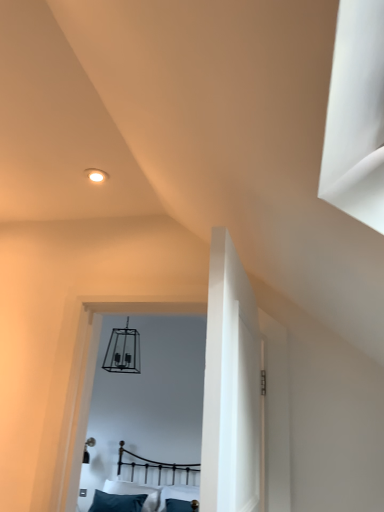
Based on the photo, measure the distance between teal fabric pillow at lower center and camera.

They are 14.17 feet apart.

Image resolution: width=384 pixels, height=512 pixels. Describe the element at coordinates (117, 502) in the screenshot. I see `teal fabric pillow at lower center` at that location.

You are a GUI agent. You are given a task and a screenshot of the screen. Output one action in this format:
    pyautogui.click(x=<x>, y=<y>)
    Task: Click on the teal fabric pillow at lower center
    This screenshot has height=512, width=384.
    Given the screenshot: What is the action you would take?
    pyautogui.click(x=117, y=502)

Find the location of a particular element. The height and width of the screenshot is (512, 384). metallic black bed at center is located at coordinates (152, 477).

What is the approximate height of metallic black bed at center?

The height of metallic black bed at center is 31.54 inches.

Describe the element at coordinates (152, 477) in the screenshot. I see `metallic black bed at center` at that location.

The image size is (384, 512). Identify the location of teal fabric pillow at lower center. (117, 502).

Considering the relative positions of metallic black bed at center and teal fabric pillow at lower center in the image provided, is metallic black bed at center to the left or to the right of teal fabric pillow at lower center?

metallic black bed at center is positioned on teal fabric pillow at lower center's right side.

From the picture: Which object is closer to the camera taking this photo, metallic black bed at center or teal fabric pillow at lower center?

metallic black bed at center is closer to the camera.

Which is in front, point (167, 481) or point (99, 506)?

The point (99, 506) is closer.

From the image's perspective, is metallic black bed at center over teal fabric pillow at lower center?

Yes, from the image's perspective, metallic black bed at center is over teal fabric pillow at lower center.

From a real-world perspective, between metallic black bed at center and teal fabric pillow at lower center, who is vertically lower?

teal fabric pillow at lower center.

Considering the relative sizes of metallic black bed at center and teal fabric pillow at lower center in the image provided, is metallic black bed at center wider than teal fabric pillow at lower center?

Yes.

Who is shorter, metallic black bed at center or teal fabric pillow at lower center?

With less height is teal fabric pillow at lower center.

Based on their sizes in the image, would you say metallic black bed at center is bigger or smaller than teal fabric pillow at lower center?

metallic black bed at center is bigger than teal fabric pillow at lower center.

Is teal fabric pillow at lower center surrounded by metallic black bed at center?

Yes, teal fabric pillow at lower center is a part of metallic black bed at center.

Is metallic black bed at center with teal fabric pillow at lower center?

No, metallic black bed at center is not in contact with teal fabric pillow at lower center.

Is metallic black bed at center looking in the opposite direction of teal fabric pillow at lower center?

No, teal fabric pillow at lower center is not at the back of metallic black bed at center.

Identify the location of bed positioned vertically above the teal fabric pillow at lower center (from a real-world perspective). The width and height of the screenshot is (384, 512). (152, 477).

Based on the photo, considering the positions of objects teal fabric pillow at lower center and metallic black bed at center in the image provided, who is more to the left, teal fabric pillow at lower center or metallic black bed at center?

From the viewer's perspective, teal fabric pillow at lower center appears more on the left side.

Looking at this image, considering the positions of objects teal fabric pillow at lower center and metallic black bed at center in the image provided, who is in front, teal fabric pillow at lower center or metallic black bed at center?

metallic black bed at center.

Considering the positions of point (117, 496) and point (143, 471), is point (117, 496) closer or farther from the camera than point (143, 471)?

Point (117, 496) is closer to the camera than point (143, 471).

From the image's perspective, which is below, teal fabric pillow at lower center or metallic black bed at center?

teal fabric pillow at lower center appears lower in the image.

From a real-world perspective, is teal fabric pillow at lower center physically located above or below metallic black bed at center?

teal fabric pillow at lower center is below metallic black bed at center.

Looking at their sizes, would you say teal fabric pillow at lower center is wider or thinner than metallic black bed at center?

Considering their sizes, teal fabric pillow at lower center looks slimmer than metallic black bed at center.

Considering the relative sizes of teal fabric pillow at lower center and metallic black bed at center in the image provided, is teal fabric pillow at lower center taller than metallic black bed at center?

In fact, teal fabric pillow at lower center may be shorter than metallic black bed at center.

Looking at this image, based on their sizes in the image, would you say teal fabric pillow at lower center is bigger or smaller than metallic black bed at center?

In the image, teal fabric pillow at lower center appears to be smaller than metallic black bed at center.

Is teal fabric pillow at lower center located outside metallic black bed at center?

No, teal fabric pillow at lower center is inside or overlapping with metallic black bed at center.

Is teal fabric pillow at lower center far away from metallic black bed at center?

They are positioned close to each other.

Is teal fabric pillow at lower center looking in the opposite direction of metallic black bed at center?

Yes, teal fabric pillow at lower center is positioned with its back facing metallic black bed at center.

Identify the location of pillow that is behind the metallic black bed at center. The image size is (384, 512). (117, 502).

Locate an element on the screen. This screenshot has height=512, width=384. pillow on the left of metallic black bed at center is located at coordinates (117, 502).

At what (x,y) coordinates should I click in order to perform the action: click on bed lying on the right of teal fabric pillow at lower center. Please return your answer as a coordinate pair (x, y). The height and width of the screenshot is (512, 384). Looking at the image, I should click on (152, 477).